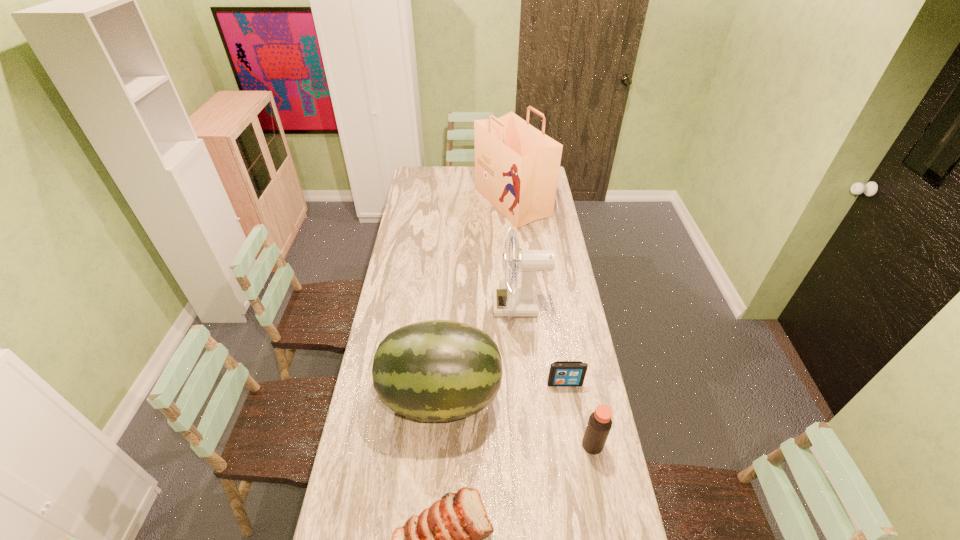
Locate an element on the screen. The height and width of the screenshot is (540, 960). unoccupied area between the iPod and the vinegar is located at coordinates (579, 414).

Identify the location of vacant area that lies between the watermelon and the third shortest object. (516, 421).

Locate an element on the screen. unoccupied position between the third shortest object and the tallest object is located at coordinates (552, 323).

The image size is (960, 540). I want to click on the third closest object to the bread, so click(x=562, y=373).

You are a GUI agent. You are given a task and a screenshot of the screen. Output one action in this format:
    pyautogui.click(x=<x>, y=<y>)
    Task: Click on the object that is the fifth closest to the third shortest object
    This screenshot has width=960, height=540.
    Given the screenshot: What is the action you would take?
    pyautogui.click(x=517, y=166)

The width and height of the screenshot is (960, 540). In order to click on free spot that satisfies the following two spatial constraints: 1. on the back side of the third shortest object; 2. on the front-facing side of the fan in this screenshot , I will do `click(565, 305)`.

Find the location of a particular element. free space that satisfies the following two spatial constraints: 1. on the side of the third shortest object with the superhero design; 2. on the left side of the grocery bag is located at coordinates (536, 445).

Locate an element on the screen. vacant space that satisfies the following two spatial constraints: 1. on the back side of the vinegar; 2. on the front-facing side of the fifth shortest object is located at coordinates (565, 305).

You are a GUI agent. You are given a task and a screenshot of the screen. Output one action in this format:
    pyautogui.click(x=<x>, y=<y>)
    Task: Click on the free region that satisfies the following two spatial constraints: 1. on the side of the third shortest object with the superhero design; 2. on the left side of the farthest object
    Image resolution: width=960 pixels, height=540 pixels.
    Given the screenshot: What is the action you would take?
    pyautogui.click(x=536, y=445)

Locate an element on the screen. This screenshot has width=960, height=540. free space that satisfies the following two spatial constraints: 1. on the side of the fourth tallest object with the superhero design; 2. on the left side of the tallest object is located at coordinates (536, 445).